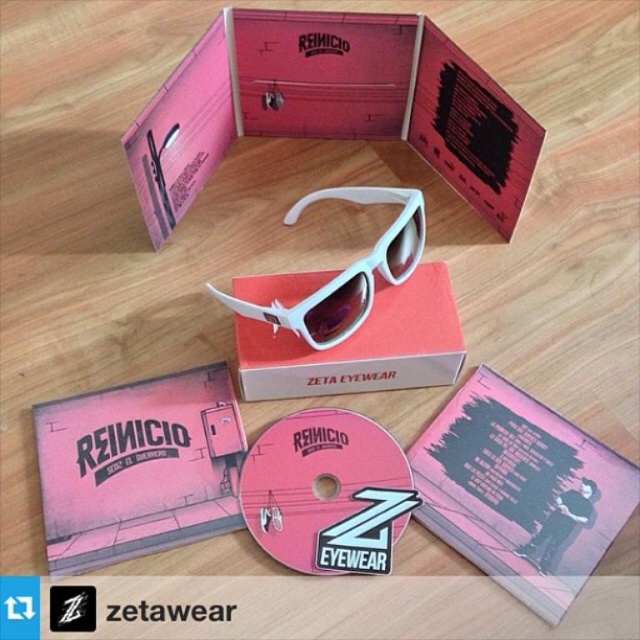
You are organizing a promotional kit for the brand Reinicio. You have a pink matte album at center and a white matte box at center. Which item is taller?

The pink matte album at center is much taller than the white matte box at center.

You are organizing a promotional event for Zeta Eyewear and need to arrange the matte pink album at center and the white matte sunglasses at center on a display table. According to the image, where should you place the matte pink album relative to the white matte sunglasses?

The matte pink album at center should be placed below the white matte sunglasses at center as per the image.

You are organizing a promotional kit for Reinicio. You need to place a sticker exactly at point (520, 492). Where should you place it?

Place the sticker at point (520, 492) on the pink matte album at center.